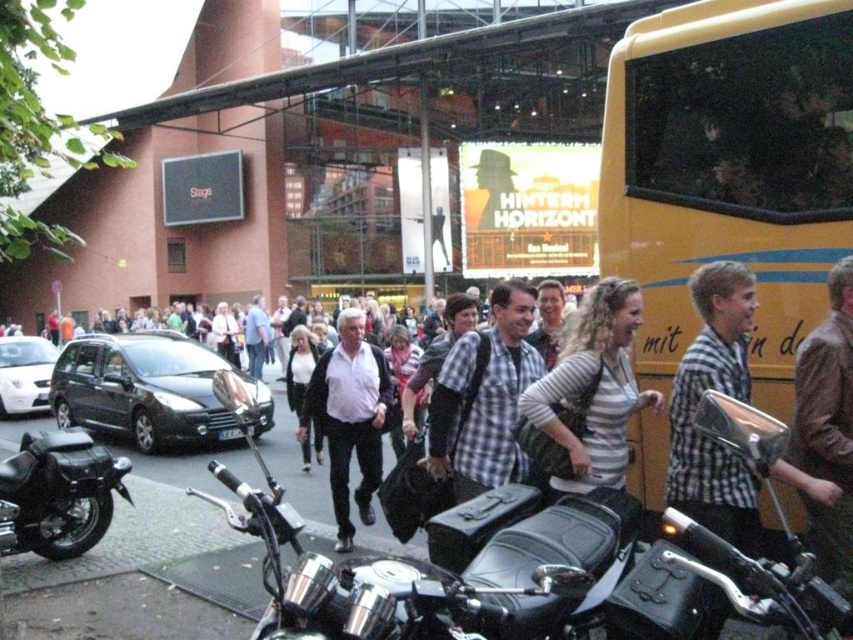
Which is above, black leather motorcycle at lower left or white matte shirt at center?

white matte shirt at center is higher up.

From the picture: Does black leather motorcycle at lower left appear over white matte shirt at center?

Actually, black leather motorcycle at lower left is below white matte shirt at center.

Measure the distance between black leather motorcycle at lower left and camera.

black leather motorcycle at lower left and camera are 5.08 meters apart from each other.

Where is `black leather motorcycle at lower left`? black leather motorcycle at lower left is located at coordinates (57, 493).

Is shiny chrome handlebars at center to the left of striped cotton shirt at center from the viewer's perspective?

Incorrect, shiny chrome handlebars at center is not on the left side of striped cotton shirt at center.

Which is more to the left, shiny chrome handlebars at center or striped cotton shirt at center?

striped cotton shirt at center

Image resolution: width=853 pixels, height=640 pixels. I want to click on shiny chrome handlebars at center, so click(722, 554).

Find the location of `shiny chrome handlebars at center`. shiny chrome handlebars at center is located at coordinates (722, 554).

Is point (802, 561) positioned after point (492, 380)?

No, (802, 561) is closer to viewer.

The image size is (853, 640). Identify the location of shiny chrome handlebars at center. (722, 554).